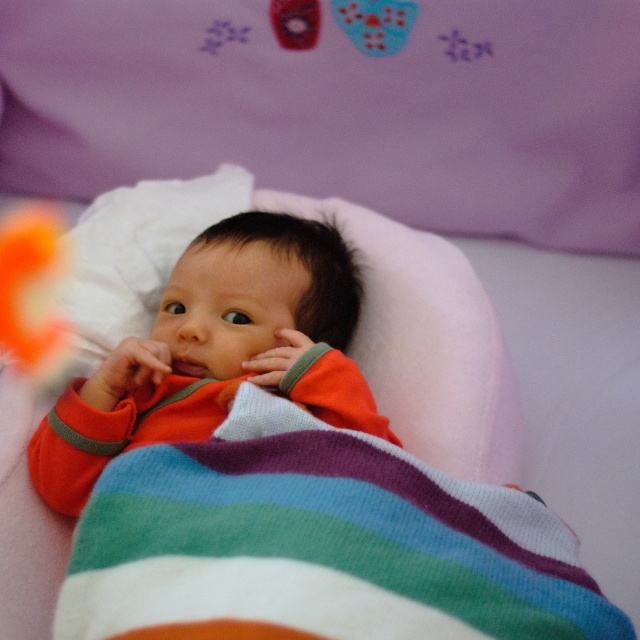
Who is lower down, orange soft fabric baby at center or orange plush toy at left?

orange soft fabric baby at center is lower down.

This screenshot has width=640, height=640. I want to click on orange soft fabric baby at center, so click(218, 352).

Can you confirm if multicolored knitted blanket at center is positioned to the left of orange plush toy at left?

In fact, multicolored knitted blanket at center is to the right of orange plush toy at left.

Is multicolored knitted blanket at center further to camera compared to orange plush toy at left?

That is False.

Where is `multicolored knitted blanket at center`? The width and height of the screenshot is (640, 640). multicolored knitted blanket at center is located at coordinates (317, 544).

You are a GUI agent. You are given a task and a screenshot of the screen. Output one action in this format:
    pyautogui.click(x=<x>, y=<y>)
    Task: Click on the multicolored knitted blanket at center
    
    Given the screenshot: What is the action you would take?
    pyautogui.click(x=317, y=544)

Which is below, pink soft pillow at upper center or orange soft fabric baby at center?

Positioned lower is orange soft fabric baby at center.

Between point (438, 157) and point (232, 310), which one is positioned behind?

Point (438, 157)

Find the location of a particular element. This screenshot has height=640, width=640. pink soft pillow at upper center is located at coordinates (340, 106).